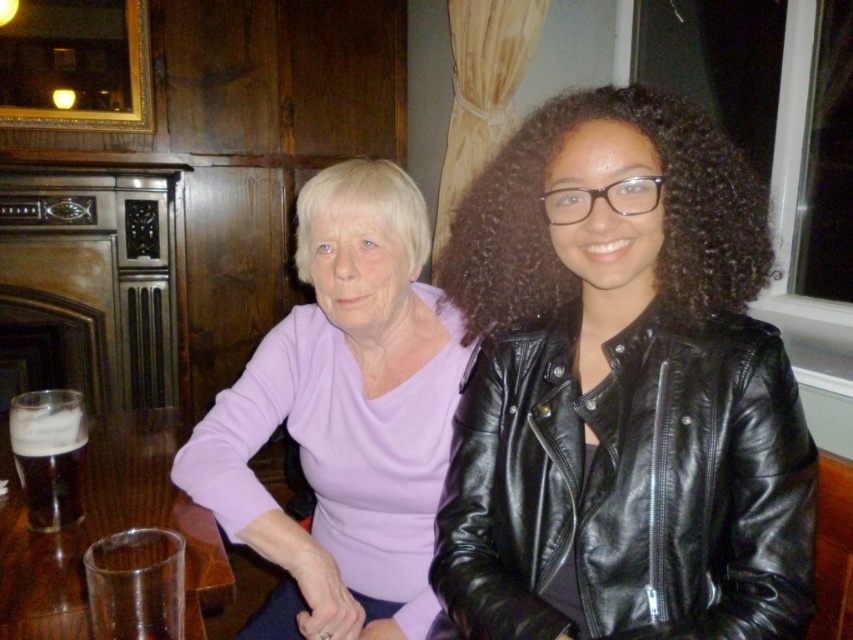
Who is more forward, (489, 465) or (4, 435)?

Point (489, 465)

At what (x,y) coordinates should I click in order to perform the action: click on matte purple sweater at upper left. Please return your answer as a coordinate pair (x, y). Looking at the image, I should click on (621, 392).

Can you confirm if transparent glass at lower left is positioned below clear glass at lower left?

Indeed, transparent glass at lower left is positioned under clear glass at lower left.

Can you confirm if transparent glass at lower left is bigger than clear glass at lower left?

Correct, transparent glass at lower left is larger in size than clear glass at lower left.

Locate an element on the screen. The width and height of the screenshot is (853, 640). transparent glass at lower left is located at coordinates (106, 531).

Locate an element on the screen. The width and height of the screenshot is (853, 640). clear glass at lower left is located at coordinates (136, 584).

In the scene shown: Who is higher up, clear glass at lower left or dark brown glass at lower left?

dark brown glass at lower left is higher up.

Does point (97, 580) lie in front of point (71, 394)?

Yes, it is in front of point (71, 394).

Find the location of a particular element. Image resolution: width=853 pixels, height=640 pixels. clear glass at lower left is located at coordinates (136, 584).